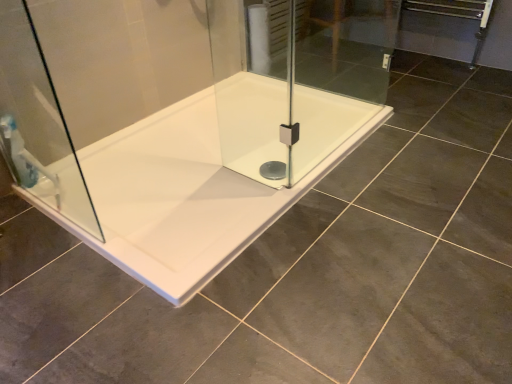
Find the location of a particular element. unoccupied area in front of transparent glass shower door at left is located at coordinates (71, 297).